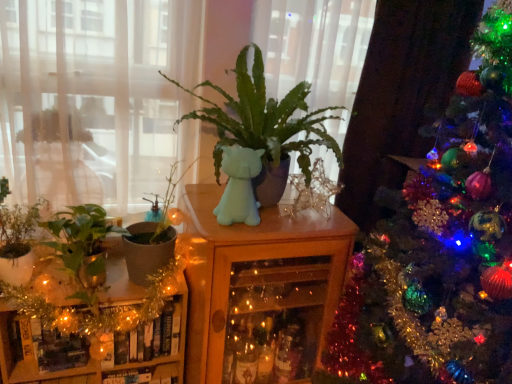
Question: Is the depth of transparent glass window at upper left less than that of green matte plant at left, the 4th houseplant positioned from the right?

Choices:
 (A) no
 (B) yes

Answer: (B)

Question: Is transparent glass window at upper left bigger than green matte plant at left, the 4th houseplant positioned from the right?

Choices:
 (A) no
 (B) yes

Answer: (B)

Question: Is transparent glass window at upper left placed right next to green matte plant at left, the 4th houseplant positioned from the right?

Choices:
 (A) no
 (B) yes

Answer: (A)

Question: From the image's perspective, is transparent glass window at upper left over green matte plant at left, arranged as the first houseplant when viewed from the left?

Choices:
 (A) no
 (B) yes

Answer: (B)

Question: Is transparent glass window at upper left to the left of green matte plant at left, arranged as the first houseplant when viewed from the left, from the viewer's perspective?

Choices:
 (A) yes
 (B) no

Answer: (B)

Question: From a real-world perspective, is green matte plant at center, acting as the fourth houseplant starting from the left, above or below green matte plant at left, the 4th houseplant positioned from the right?

Choices:
 (A) above
 (B) below

Answer: (A)

Question: In terms of width, does green matte plant at center, acting as the fourth houseplant starting from the left, look wider or thinner when compared to green matte plant at left, arranged as the first houseplant when viewed from the left?

Choices:
 (A) wide
 (B) thin

Answer: (A)

Question: Do you think green matte plant at center, acting as the fourth houseplant starting from the left, is within green matte plant at left, arranged as the first houseplant when viewed from the left, or outside of it?

Choices:
 (A) outside
 (B) inside

Answer: (A)

Question: Considering the positions of green matte plant at center, acting as the fourth houseplant starting from the left, and green matte plant at left, the 4th houseplant positioned from the right, in the image, is green matte plant at center, acting as the fourth houseplant starting from the left, bigger or smaller than green matte plant at left, the 4th houseplant positioned from the right,?

Choices:
 (A) small
 (B) big

Answer: (B)

Question: From the image's perspective, is green matte plant at center, which is counted as the first houseplant, starting from the right, located above or below wooden cabinet at center, the 1th furniture positioned from the right?

Choices:
 (A) below
 (B) above

Answer: (B)

Question: Is green matte plant at center, which is counted as the first houseplant, starting from the right, situated inside wooden cabinet at center, positioned as the 2th furniture in left-to-right order, or outside?

Choices:
 (A) outside
 (B) inside

Answer: (A)

Question: Based on their positions, is green matte plant at center, which is counted as the first houseplant, starting from the right, located to the left or right of wooden cabinet at center, the 1th furniture positioned from the right?

Choices:
 (A) right
 (B) left

Answer: (A)

Question: From a real-world perspective, is green matte plant at center, acting as the fourth houseplant starting from the left, positioned above or below wooden cabinet at center, the 1th furniture positioned from the right?

Choices:
 (A) below
 (B) above

Answer: (B)

Question: In the image, is shiny green christmas tree at right positioned in front of or behind gold tinsel garland at lower left, the second furniture from the right?

Choices:
 (A) front
 (B) behind

Answer: (A)

Question: Would you say shiny green christmas tree at right is to the left or to the right of gold tinsel garland at lower left, the second furniture from the right, in the picture?

Choices:
 (A) right
 (B) left

Answer: (A)